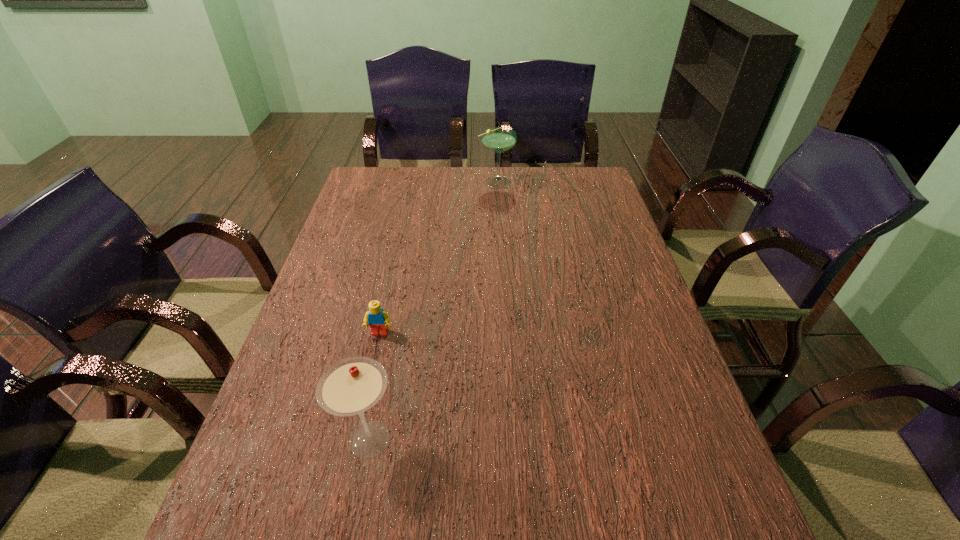
Find the location of a particular element. This screenshot has height=540, width=960. free space at the far edge of the desktop is located at coordinates click(520, 195).

Identify the location of vacant region at the left edge of the desktop. (368, 279).

Where is `free space at the right edge of the desktop`? free space at the right edge of the desktop is located at coordinates (630, 254).

At what (x,y) coordinates should I click in order to perform the action: click on free region at the far right corner of the desktop. Please return your answer as a coordinate pair (x, y). This screenshot has height=540, width=960. Looking at the image, I should click on (560, 180).

At what (x,y) coordinates should I click in order to perform the action: click on vacant space that is in between the shortest object and the farther martini. Please return your answer as a coordinate pair (x, y). Looking at the image, I should click on (438, 258).

Identify the location of free space between the rightmost object and the shortest object. The height and width of the screenshot is (540, 960). tap(438, 258).

Image resolution: width=960 pixels, height=540 pixels. I want to click on vacant region between the left martini and the rightmost object, so 433,310.

I want to click on free space between the nearer martini and the rightmost object, so click(433, 310).

What are the coordinates of `empty location between the nearer martini and the farthest object` in the screenshot? It's located at click(433, 310).

Where is `empty space that is in between the rightmost object and the Lego`? empty space that is in between the rightmost object and the Lego is located at coordinates (438, 258).